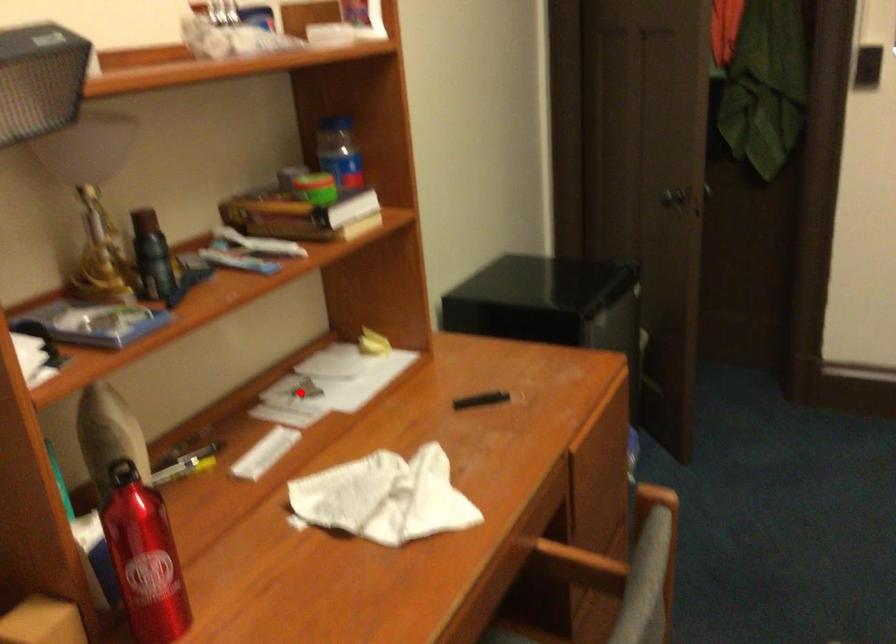
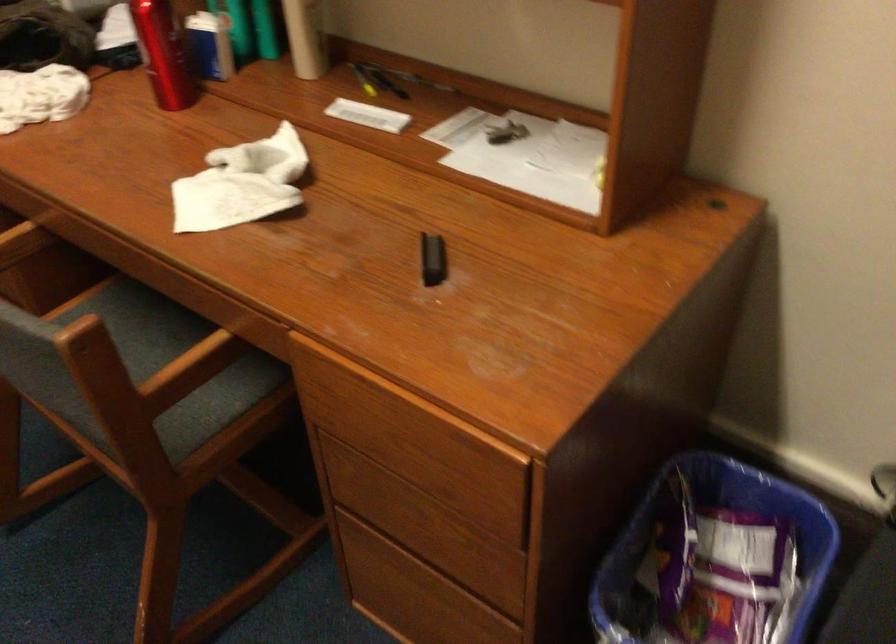
Question: A red point is marked in image1. In image2, is the corresponding 3D point closer to the camera or farther? Reply with the corresponding letter.

Choices:
 (A) The corresponding 3D point is closer.
 (B) The corresponding 3D point is farther.

Answer: (A)